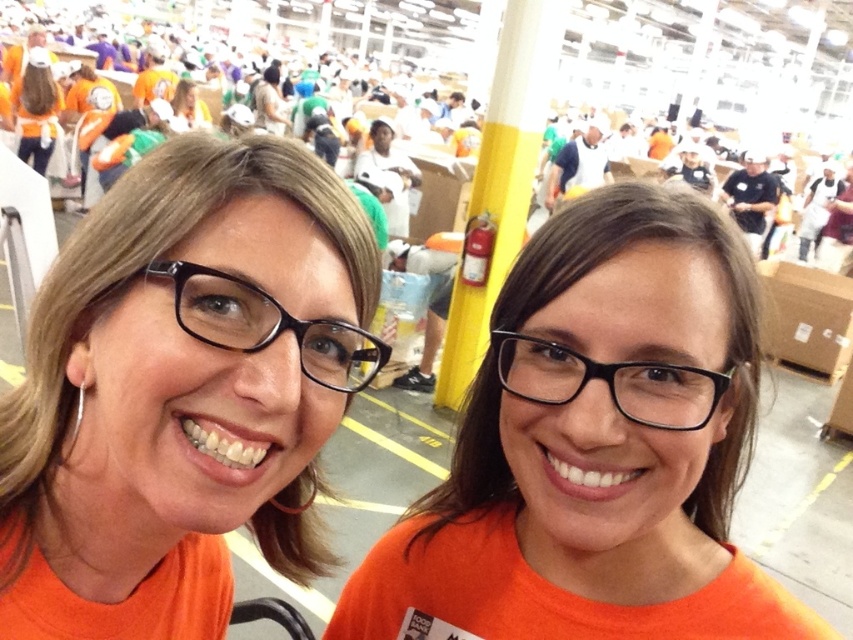
You are standing in the warehouse and need to find the black plastic glasses at left. According to the scene description, where exactly are they positioned?

The black plastic glasses at left are located at point (267, 324).